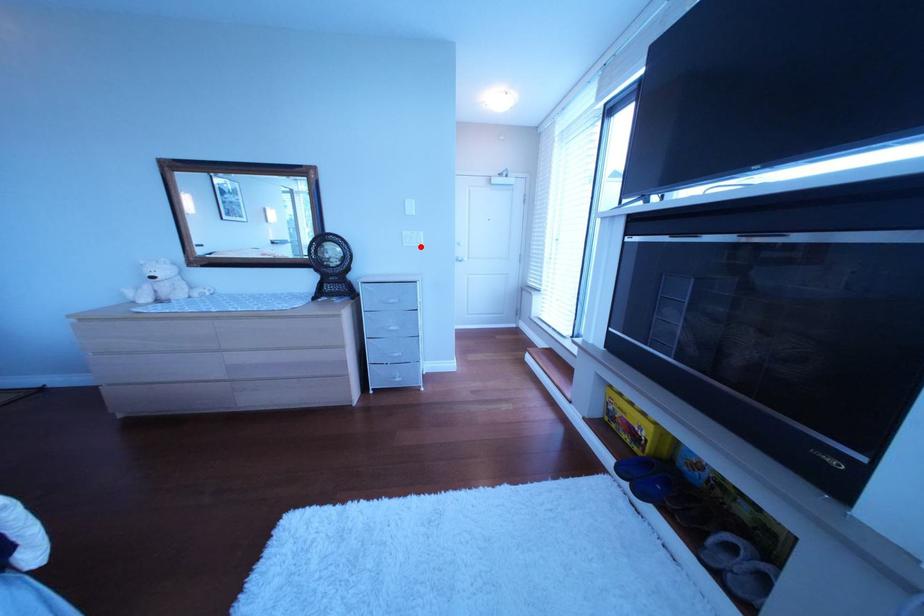
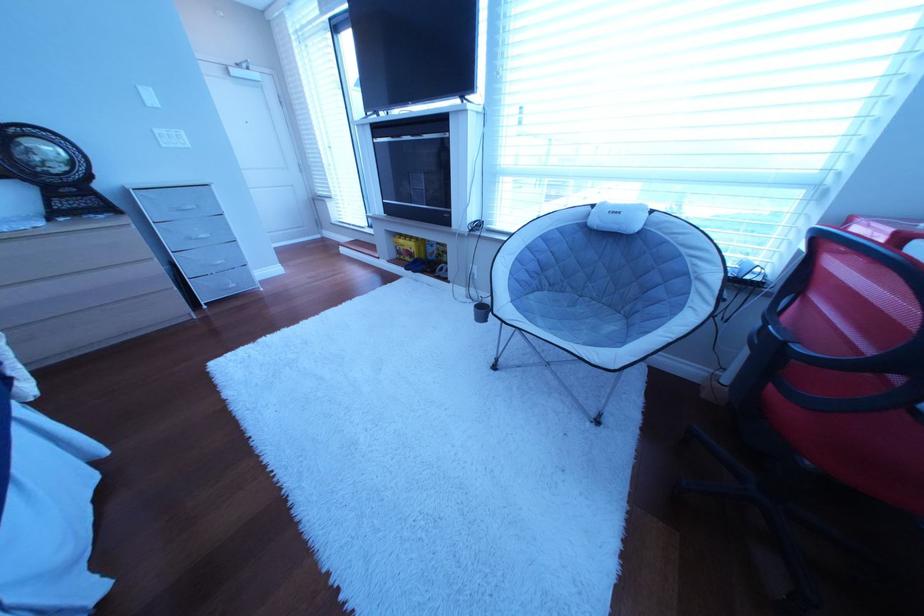
Question: I am providing you with two images of the same scene from different viewpoints. A red point is marked on the first image. Can you still see the location of the red point in image 2?

Choices:
 (A) Yes
 (B) No

Answer: (A)